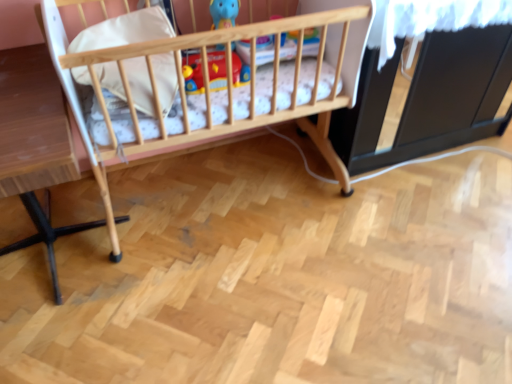
Locate an element on the screen. vacant space that's between wooden crib at center and light brown wooden table at left is located at coordinates (217, 243).